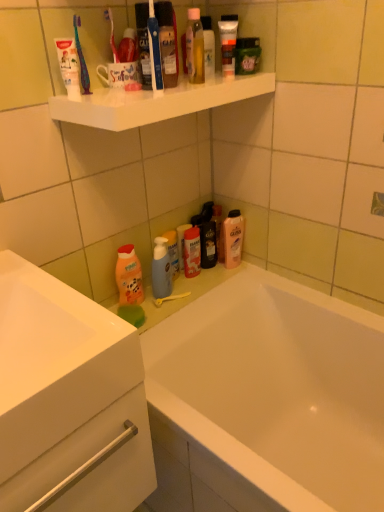
What are the coordinates of `green matte soap at upper right, the first toiletry from the right` in the screenshot? It's located at (247, 55).

Measure the distance between point (131, 279) and camera.

The distance of point (131, 279) from camera is 4.48 feet.

What do you see at coordinates (173, 252) in the screenshot? I see `translucent plastic pump bottle at lower center, the 1th toiletry from the bottom` at bounding box center [173, 252].

In the scene shown: What is the approximate width of translucent plastic mouthwash at lower center?

It is 3.23 inches.

This screenshot has width=384, height=512. What do you see at coordinates (233, 238) in the screenshot?
I see `translucent plastic mouthwash at lower center` at bounding box center [233, 238].

Where is `white glossy cabinet at lower left`? This screenshot has width=384, height=512. white glossy cabinet at lower left is located at coordinates (68, 399).

Describe the element at coordinates (156, 102) in the screenshot. The width and height of the screenshot is (384, 512). I see `white glossy shelf at upper center` at that location.

The width and height of the screenshot is (384, 512). What are the coordinates of `white matte toothpaste at upper left` in the screenshot? It's located at (69, 66).

How much space does matte plastic tube at upper center, marked as the 2th toiletry in a top-to-bottom arrangement, occupy vertically?

matte plastic tube at upper center, marked as the 2th toiletry in a top-to-bottom arrangement, is 5.91 inches in height.

Measure the distance between point (x=230, y=53) and camera.

A distance of 1.17 meters exists between point (x=230, y=53) and camera.

Locate an element on the screen. green matte soap at upper right, the fourth toiletry when ordered from left to right is located at coordinates (247, 55).

From the image's perspective, relative to matte plastic tube at upper center, arranged as the third toiletry when viewed from the left, is orange matte bottle at lower left above or below?

Clearly, from the image's perspective, orange matte bottle at lower left is below matte plastic tube at upper center, arranged as the third toiletry when viewed from the left.

Find the location of a particular element. cleaning product located on the left of matte plastic tube at upper center, arranged as the third toiletry when viewed from the left is located at coordinates click(129, 276).

Between orange matte bottle at lower left and matte plastic tube at upper center, which is the third toiletry from bottom to top, which one has larger width?

Wider between the two is matte plastic tube at upper center, which is the third toiletry from bottom to top.

Considering the positions of point (138, 287) and point (226, 66), is point (138, 287) closer or farther from the camera than point (226, 66)?

Clearly, point (138, 287) is more distant from the camera than point (226, 66).

In the scene shown: From a real-world perspective, which is physically below, translucent plastic pump bottle at lower center, marked as the fourth toiletry in a top-to-bottom arrangement, or green matte soap at upper right, the fourth toiletry when ordered from left to right?

translucent plastic pump bottle at lower center, marked as the fourth toiletry in a top-to-bottom arrangement, from a real-world perspective.

Can you confirm if translucent plastic pump bottle at lower center, placed as the second toiletry when sorted from back to front, is taller than green matte soap at upper right, the fourth toiletry in the bottom-to-top sequence?

Yes, translucent plastic pump bottle at lower center, placed as the second toiletry when sorted from back to front, is taller than green matte soap at upper right, the fourth toiletry in the bottom-to-top sequence.

Consider the image. Is translucent plastic pump bottle at lower center, the 1th toiletry viewed from the left, inside the boundaries of green matte soap at upper right, which is the third toiletry in back-to-front order, or outside?

translucent plastic pump bottle at lower center, the 1th toiletry viewed from the left, exists outside the volume of green matte soap at upper right, which is the third toiletry in back-to-front order.

From the image's perspective, relative to green matte soap at upper right, acting as the 2th toiletry starting from the front, is translucent plastic pump bottle at lower center, the fourth toiletry when ordered from right to left, above or below?

translucent plastic pump bottle at lower center, the fourth toiletry when ordered from right to left, is situated lower than green matte soap at upper right, acting as the 2th toiletry starting from the front, in the image.

From the picture: From the image's perspective, is white matte toothpaste at upper left above green matte soap at upper right, the fourth toiletry when ordered from left to right?

Actually, white matte toothpaste at upper left appears below green matte soap at upper right, the fourth toiletry when ordered from left to right, in the image.

Visually, is white matte toothpaste at upper left positioned to the left or to the right of green matte soap at upper right, the fourth toiletry when ordered from left to right?

In the image, white matte toothpaste at upper left appears on the left side of green matte soap at upper right, the fourth toiletry when ordered from left to right.

Could you tell me if white matte toothpaste at upper left is facing green matte soap at upper right, the fourth toiletry when ordered from left to right?

No, white matte toothpaste at upper left is not turned towards green matte soap at upper right, the fourth toiletry when ordered from left to right.

From a real-world perspective, is white matte toothpaste at upper left positioned above or below green matte soap at upper right, the first toiletry from the right?

A: Clearly, from a real-world perspective, white matte toothpaste at upper left is above green matte soap at upper right, the first toiletry from the right.

Based on the photo, between translucent plastic pump bottle at lower center, placed as the second toiletry when sorted from back to front, and white glossy shelf at upper center, which one has smaller size?

Smaller between the two is translucent plastic pump bottle at lower center, placed as the second toiletry when sorted from back to front.

Locate an element on the screen. This screenshot has width=384, height=512. shelf in front of the translucent plastic pump bottle at lower center, which is the 3th toiletry in front-to-back order is located at coordinates (156, 102).

In the scene shown: Which object is wider, translucent plastic pump bottle at lower center, the 1th toiletry viewed from the left, or white glossy shelf at upper center?

With larger width is white glossy shelf at upper center.

Which object is more forward, translucent plastic pump bottle at lower center, which is the 3th toiletry in front-to-back order, or white glossy shelf at upper center?

white glossy shelf at upper center is more forward.

Which of these two, translucent plastic pump bottle at lower center, the fourth toiletry when ordered from right to left, or white matte toothpaste at upper left, is bigger?

With larger size is translucent plastic pump bottle at lower center, the fourth toiletry when ordered from right to left.

Considering the positions of objects translucent plastic pump bottle at lower center, marked as the fourth toiletry in a top-to-bottom arrangement, and white matte toothpaste at upper left in the image provided, who is more to the right, translucent plastic pump bottle at lower center, marked as the fourth toiletry in a top-to-bottom arrangement, or white matte toothpaste at upper left?

Positioned to the right is translucent plastic pump bottle at lower center, marked as the fourth toiletry in a top-to-bottom arrangement.

Between translucent plastic pump bottle at lower center, the fourth toiletry when ordered from right to left, and white matte toothpaste at upper left, which one has more height?

Standing taller between the two is translucent plastic pump bottle at lower center, the fourth toiletry when ordered from right to left.

From a real-world perspective, is translucent plastic bottle at lower center, the fourth toiletry positioned from the front, above or below white matte toothpaste at upper left?

Clearly, from a real-world perspective, translucent plastic bottle at lower center, the fourth toiletry positioned from the front, is below white matte toothpaste at upper left.

Based on the photo, can white matte toothpaste at upper left be found inside translucent plastic bottle at lower center, which is the 1th toiletry from back to front?

No, white matte toothpaste at upper left is not surrounded by translucent plastic bottle at lower center, which is the 1th toiletry from back to front.

Is translucent plastic bottle at lower center, which is the second toiletry from left to right, taller than white matte toothpaste at upper left?

Indeed, translucent plastic bottle at lower center, which is the second toiletry from left to right, has a greater height compared to white matte toothpaste at upper left.

From a real-world perspective, is translucent plastic toothbrush at upper left over translucent plastic mouthwash at lower center?

Correct, in the physical world, translucent plastic toothbrush at upper left is higher than translucent plastic mouthwash at lower center.

Does point (86, 82) come in front of point (238, 245)?

That is True.

Does translucent plastic toothbrush at upper left touch translucent plastic mouthwash at lower center?

translucent plastic toothbrush at upper left is not next to translucent plastic mouthwash at lower center, and they're not touching.

Who is bigger, translucent plastic toothbrush at upper left or translucent plastic mouthwash at lower center?

translucent plastic mouthwash at lower center.

From a real-world perspective, which toiletry is the 2nd one above the orange matte bottle at lower left? Please provide its 2D coordinates.

[(228, 42)]

From the translucent plastic pump bottle at lower center, the fourth toiletry when ordered from right to left, count 1st toiletrys forward and point to it. Please provide its 2D coordinates.

[(247, 55)]

From the image, which object appears to be nearer to white glossy bathtub at lower center, translucent plastic toothbrush at upper left or translucent plastic pump bottle at lower center, the fourth toiletry when ordered from right to left?

Among the two, translucent plastic pump bottle at lower center, the fourth toiletry when ordered from right to left, is located nearer to white glossy bathtub at lower center.

From the image, which object appears to be nearer to white glossy cabinet at lower left, white glossy bathtub at lower center or white matte toothpaste at upper left?

white glossy bathtub at lower center is closer to white glossy cabinet at lower left.

When comparing their distances from green matte soap at upper right, which is the third toiletry in back-to-front order, does translucent plastic pump bottle at lower center, the 1th toiletry from the bottom, or translucent plastic mouthwash at lower center seem further?

translucent plastic pump bottle at lower center, the 1th toiletry from the bottom, is further to green matte soap at upper right, which is the third toiletry in back-to-front order.

Estimate the real-world distances between objects in this image. Which object is further from translucent plastic mouthwash at lower center, orange matte bottle at lower left or white matte toothpaste at upper left?

white matte toothpaste at upper left is further to translucent plastic mouthwash at lower center.

When comparing their distances from translucent plastic toothbrush at upper left, does translucent plastic mouthwash at lower center or orange matte bottle at lower left seem closer?

orange matte bottle at lower left lies closer to translucent plastic toothbrush at upper left than the other object.

Looking at this image, estimate the real-world distances between objects in this image. Which object is closer to white matte toothpaste at upper left, white glossy shelf at upper center or green matte soap at upper right, which is the third toiletry in back-to-front order?

Based on the image, white glossy shelf at upper center appears to be nearer to white matte toothpaste at upper left.

Based on their spatial positions, is matte plastic tube at upper center, which appears as the first toiletry when viewed from the front, or white glossy cabinet at lower left further from white matte toothpaste at upper left?

white glossy cabinet at lower left.

In the scene shown: Which object lies nearer to the anchor point translucent plastic bottle at lower center, arranged as the 3th toiletry when viewed from the top, orange matte bottle at lower left or green matte soap at upper right, the 1th toiletry when ordered from top to bottom?

orange matte bottle at lower left is closer to translucent plastic bottle at lower center, arranged as the 3th toiletry when viewed from the top.

Image resolution: width=384 pixels, height=512 pixels. I want to click on toothpaste between white glossy cabinet at lower left and translucent plastic bottle at lower center, arranged as the 3th toiletry when viewed from the top, from front to back, so click(69, 66).

At what (x,y) coordinates should I click in order to perform the action: click on shelf between white matte toothpaste at upper left and white glossy cabinet at lower left from top to bottom. Please return your answer as a coordinate pair (x, y). Looking at the image, I should click on (156, 102).

The width and height of the screenshot is (384, 512). I want to click on cleaning product positioned between white glossy shelf at upper center and translucent plastic mouthwash at lower center from near to far, so click(129, 276).

Locate an element on the screen. toiletry between matte plastic tube at upper center, marked as the 2th toiletry in a right-to-left arrangement, and translucent plastic pump bottle at lower center, the fourth toiletry when ordered from right to left, in the up-down direction is located at coordinates (192, 252).